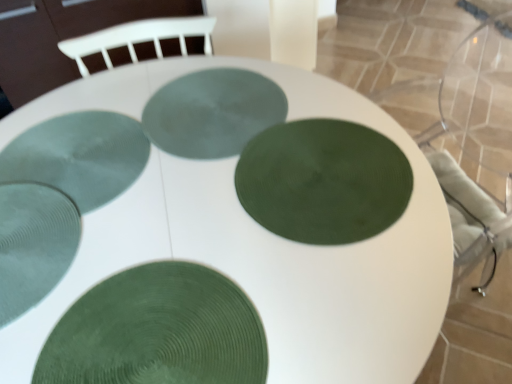
Where is `vacant area that lies between green textured glass plate at center, which appears as the 5th glass plate when viewed from the front, and clear textured glass at bottom left, the fourth glass plate from the back`? The height and width of the screenshot is (384, 512). vacant area that lies between green textured glass plate at center, which appears as the 5th glass plate when viewed from the front, and clear textured glass at bottom left, the fourth glass plate from the back is located at coordinates (120, 177).